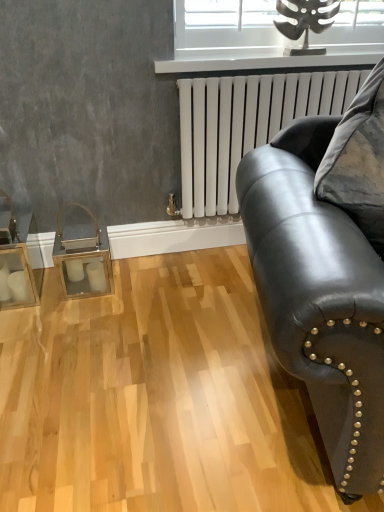
Question: Is metallic silver window at upper center wider than black leather couch at right?

Choices:
 (A) no
 (B) yes

Answer: (A)

Question: From a real-world perspective, is metallic silver window at upper center physically below black leather couch at right?

Choices:
 (A) yes
 (B) no

Answer: (B)

Question: Is metallic silver window at upper center looking in the opposite direction of black leather couch at right?

Choices:
 (A) yes
 (B) no

Answer: (B)

Question: Is metallic silver window at upper center next to black leather couch at right?

Choices:
 (A) yes
 (B) no

Answer: (B)

Question: Considering the relative positions of metallic silver window at upper center and black leather couch at right in the image provided, is metallic silver window at upper center to the right of black leather couch at right from the viewer's perspective?

Choices:
 (A) yes
 (B) no

Answer: (B)

Question: From the image's perspective, is metallic silver window at upper center below black leather couch at right?

Choices:
 (A) yes
 (B) no

Answer: (B)

Question: Does metallic silver window at upper center have a greater height compared to white matte radiator at upper right?

Choices:
 (A) no
 (B) yes

Answer: (A)

Question: Can you confirm if metallic silver window at upper center is thinner than white matte radiator at upper right?

Choices:
 (A) yes
 (B) no

Answer: (A)

Question: Does metallic silver window at upper center lie in front of white matte radiator at upper right?

Choices:
 (A) no
 (B) yes

Answer: (A)

Question: Is metallic silver window at upper center not within white matte radiator at upper right?

Choices:
 (A) no
 (B) yes

Answer: (B)

Question: Can you confirm if metallic silver window at upper center is positioned to the left of white matte radiator at upper right?

Choices:
 (A) yes
 (B) no

Answer: (B)

Question: Is metallic silver window at upper center smaller than white matte radiator at upper right?

Choices:
 (A) yes
 (B) no

Answer: (A)

Question: From the image's perspective, is white glossy radiator at upper center above metallic silver window at upper center?

Choices:
 (A) yes
 (B) no

Answer: (B)